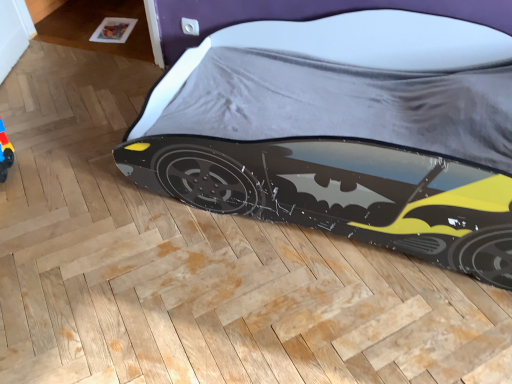
Locate an element on the screen. Image resolution: width=512 pixels, height=384 pixels. free space that is to the left of matt black car at lower right is located at coordinates (87, 174).